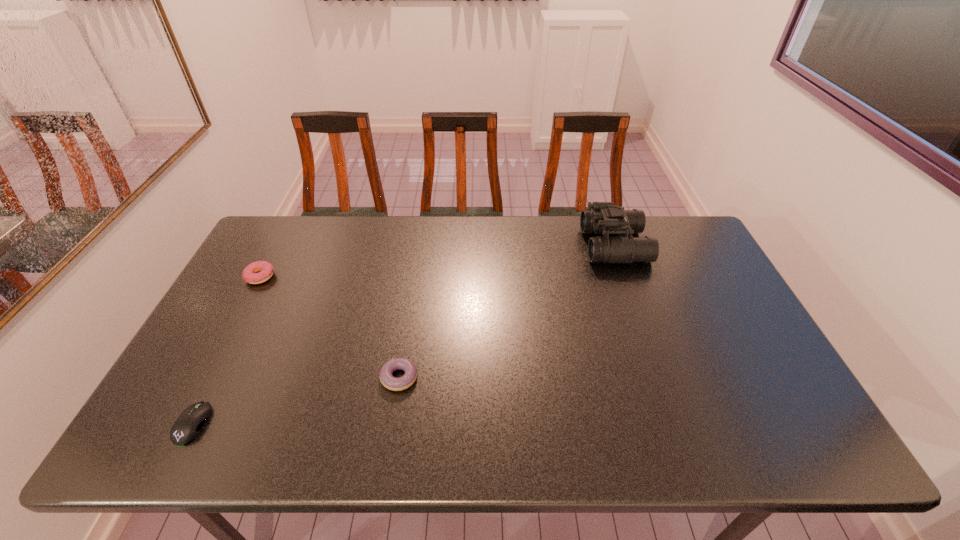
Image resolution: width=960 pixels, height=540 pixels. I want to click on unoccupied position between the binoculars and the left doughnut, so click(437, 261).

Locate an element on the screen. The image size is (960, 540). unoccupied position between the farther doughnut and the binoculars is located at coordinates (437, 261).

Locate which object is the second closest to the tallest object. Please provide its 2D coordinates. Your answer should be formatted as a tuple, i.e. [(x, y)], where the tuple contains the x and y coordinates of a point satisfying the conditions above.

[(265, 270)]

Select which object is the second closest to the third object from left to right. Please provide its 2D coordinates. Your answer should be formatted as a tuple, i.e. [(x, y)], where the tuple contains the x and y coordinates of a point satisfying the conditions above.

[(265, 270)]

Image resolution: width=960 pixels, height=540 pixels. I want to click on free space that satisfies the following two spatial constraints: 1. on the front side of the farther doughnut; 2. on the left side of the nearest object, so click(181, 423).